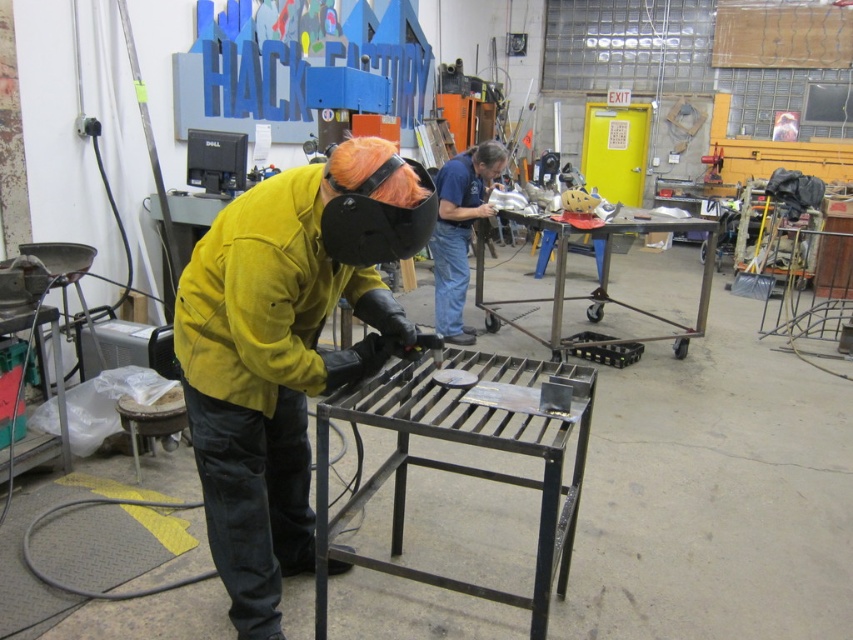
What do you see at coordinates (286, 348) in the screenshot? Image resolution: width=853 pixels, height=640 pixels. I see `yellow leather jacket at center` at bounding box center [286, 348].

Does yellow leather jacket at center have a larger size compared to blue denim shirt at center?

Indeed, yellow leather jacket at center has a larger size compared to blue denim shirt at center.

Which is behind, point (263, 330) or point (433, 228)?

Point (433, 228)

Locate an element on the screen. The image size is (853, 640). yellow leather jacket at center is located at coordinates (286, 348).